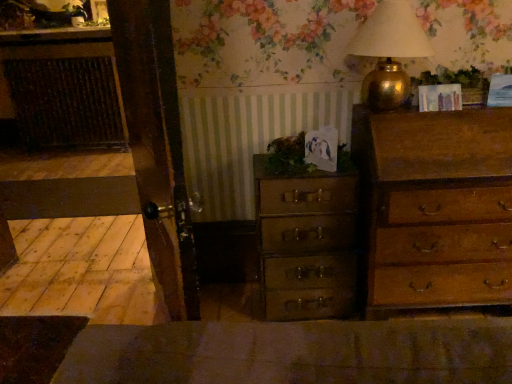
The width and height of the screenshot is (512, 384). What are the coordinates of `vacant region below green leafy plant at center, the first plant from the bottom (from a real-world perspective)` in the screenshot? It's located at (275, 175).